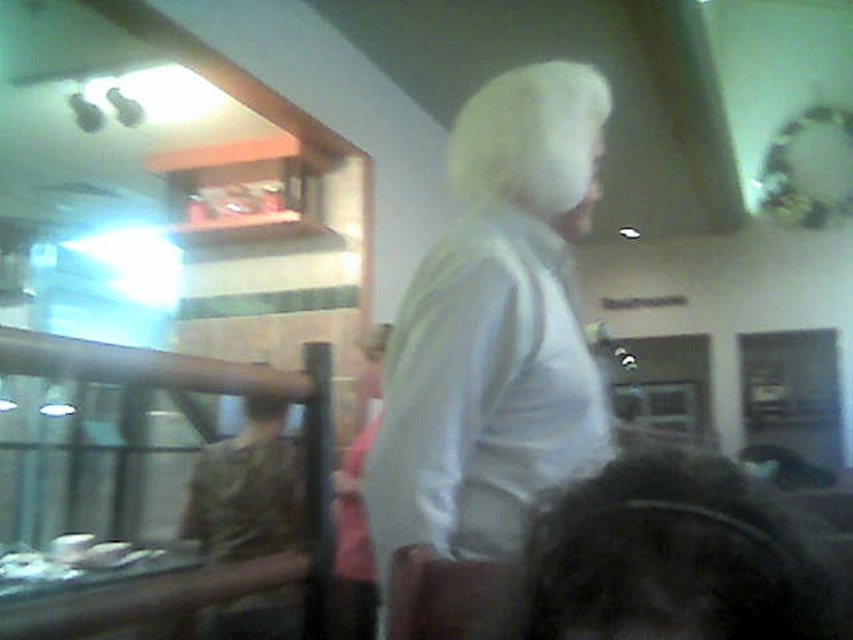
You are a customer in a restaurant and you see two people with distinct hairstyles. One has dark curly hair at lower right and the other has white matte hair at upper center. Which person is positioned more to the east if you are facing the counter?

The dark curly hair at lower right is to the right of white matte hair at upper center, so if you are facing the counter, the dark curly hair at lower right is positioned more to the east.